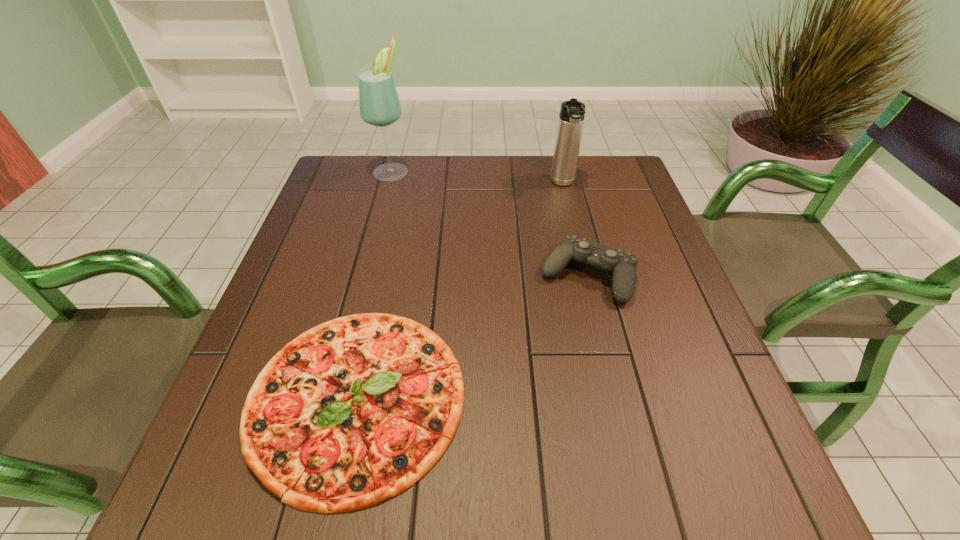
This screenshot has height=540, width=960. I want to click on free space between the thermos bottle and the shortest object, so click(460, 291).

Locate an element on the screen. This screenshot has width=960, height=540. vacant space that's between the thermos bottle and the tallest object is located at coordinates (477, 177).

This screenshot has height=540, width=960. I want to click on blank region between the alcohol and the nearest object, so click(374, 284).

Locate which object ranks third in proximity to the third shortest object. Please provide its 2D coordinates. Your answer should be formatted as a tuple, i.e. [(x, y)], where the tuple contains the x and y coordinates of a point satisfying the conditions above.

[(352, 412)]

The width and height of the screenshot is (960, 540). I want to click on object that stands as the closest to the tallest object, so click(571, 117).

This screenshot has height=540, width=960. What are the coordinates of `vacant space that satisfies the following two spatial constraints: 1. on the handle side of the second shortest object; 2. on the right side of the thermos bottle` in the screenshot? It's located at (585, 276).

Locate an element on the screen. This screenshot has width=960, height=540. vacant space that satisfies the following two spatial constraints: 1. on the front side of the tallest object; 2. on the left side of the control is located at coordinates (364, 276).

The height and width of the screenshot is (540, 960). Find the location of `vacant space that satisfies the following two spatial constraints: 1. on the back side of the second nearest object; 2. on the right side of the shortest object`. vacant space that satisfies the following two spatial constraints: 1. on the back side of the second nearest object; 2. on the right side of the shortest object is located at coordinates (383, 276).